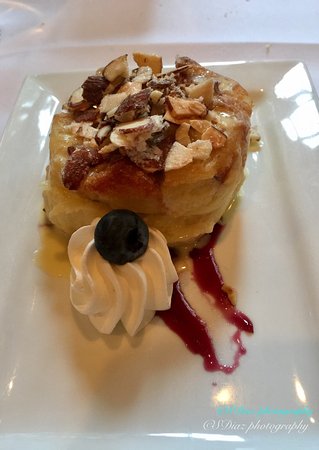
The height and width of the screenshot is (450, 319). I want to click on white dessert plate, so click(x=159, y=362).